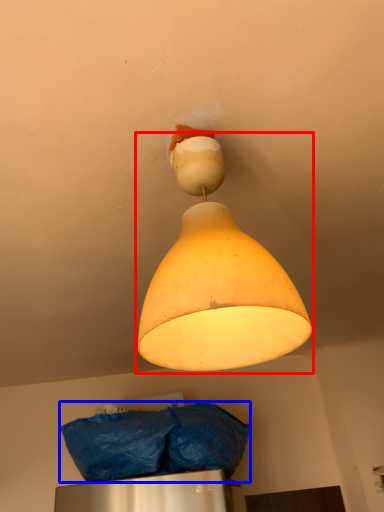
Question: Which object is closer to the camera taking this photo, lamp (highlighted by a red box) or material (highlighted by a blue box)?

Choices:
 (A) lamp
 (B) material

Answer: (A)